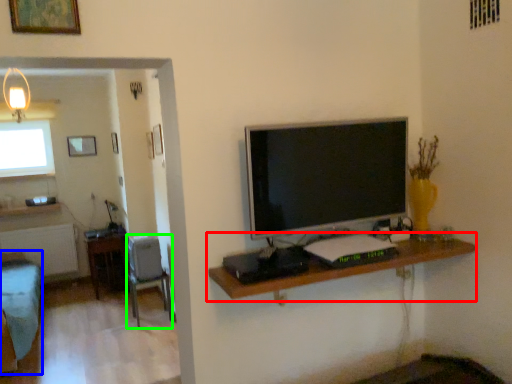
Question: Considering the real-world distances, which object is farthest from shelf (highlighted by a red box)? furniture (highlighted by a blue box) or chair (highlighted by a green box)?

Choices:
 (A) furniture
 (B) chair

Answer: (A)